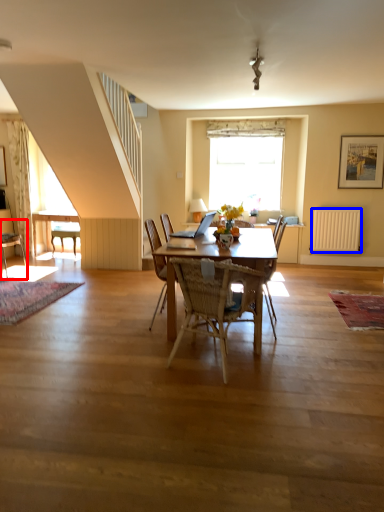
Question: Which object appears farthest to the camera in this image, chair (highlighted by a red box) or radiator (highlighted by a blue box)?

Choices:
 (A) chair
 (B) radiator

Answer: (B)